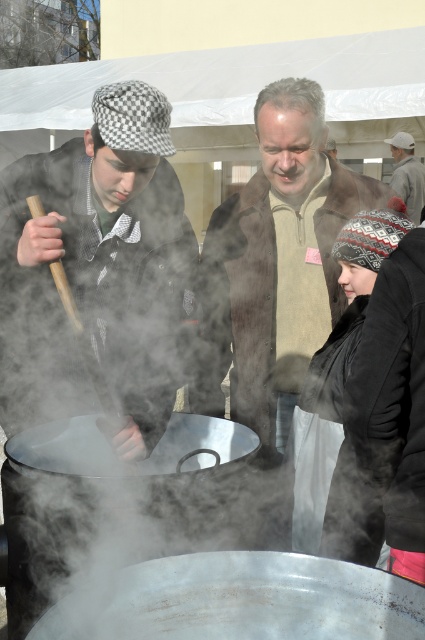
Question: Which object appears farthest from the camera in this image?

Choices:
 (A) brown leather jacket at center
 (B) checkered fabric hat at left
 (C) gray knit hat at upper right

Answer: (C)

Question: Does brown leather jacket at center lie in front of gray knit hat at upper right?

Choices:
 (A) yes
 (B) no

Answer: (A)

Question: Is checkered fabric hat at left to the right of gray knit hat at upper right from the viewer's perspective?

Choices:
 (A) no
 (B) yes

Answer: (A)

Question: Which of the following is the farthest from the observer?

Choices:
 (A) (93, 220)
 (B) (419, 184)
 (C) (278, 420)

Answer: (B)

Question: Considering the relative positions of checkered fabric hat at left and brown leather jacket at center in the image provided, where is checkered fabric hat at left located with respect to brown leather jacket at center?

Choices:
 (A) above
 (B) below

Answer: (B)

Question: Which object is the farthest from the checkered fabric hat at left?

Choices:
 (A) brown leather jacket at center
 (B) gray knit hat at upper right

Answer: (B)